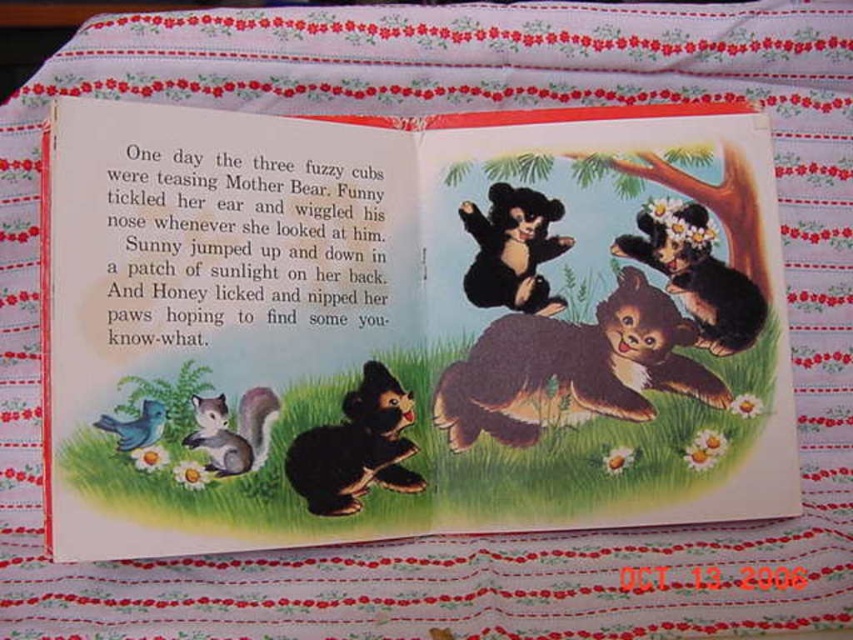
Question: Among these objects, which one is nearest to the camera?

Choices:
 (A) brown furry bear at center
 (B) shiny black bear at upper right
 (C) gray furry squirrel at lower left
 (D) blue matte bird at lower left

Answer: (B)

Question: Does shiny black bear at lower center appear on the left side of fluffy brown bear at upper right?

Choices:
 (A) no
 (B) yes

Answer: (B)

Question: Which point is closer to the camera?

Choices:
 (A) shiny black bear at upper right
 (B) black matte bear at upper center
 (C) shiny black bear at lower center
 (D) gray furry squirrel at lower left

Answer: (A)

Question: Where is black matte bear at upper center located in relation to gray furry squirrel at lower left in the image?

Choices:
 (A) left
 (B) right

Answer: (B)

Question: Is fluffy brown bear at upper right to the right of blue matte bird at lower left from the viewer's perspective?

Choices:
 (A) no
 (B) yes

Answer: (B)

Question: Which object is positioned farthest from the blue matte bird at lower left?

Choices:
 (A) gray furry squirrel at lower left
 (B) shiny black bear at lower center

Answer: (B)